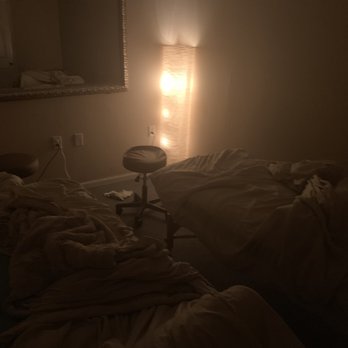
Where is `cord`? Image resolution: width=348 pixels, height=348 pixels. cord is located at coordinates (57, 146).